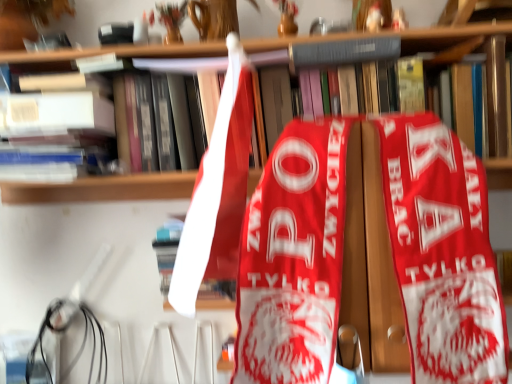
Question: Is hardcover book at upper center, the first book when ordered from right to left, aimed at matte white book at upper left, which is the second book from right to left?

Choices:
 (A) yes
 (B) no

Answer: (B)

Question: Does hardcover book at upper center, which is the 1th book in top-to-bottom order, appear on the left side of matte white book at upper left, arranged as the first book when ordered from the bottom?

Choices:
 (A) no
 (B) yes

Answer: (A)

Question: Can you confirm if hardcover book at upper center, the first book when ordered from right to left, is bigger than matte white book at upper left, which is the second book from right to left?

Choices:
 (A) no
 (B) yes

Answer: (A)

Question: Considering the relative positions of hardcover book at upper center, which is the 1th book in top-to-bottom order, and matte white book at upper left, which is the second book from right to left, in the image provided, is hardcover book at upper center, which is the 1th book in top-to-bottom order, behind matte white book at upper left, which is the second book from right to left,?

Choices:
 (A) yes
 (B) no

Answer: (B)

Question: Can you confirm if hardcover book at upper center, the first book when ordered from right to left, is thinner than matte white book at upper left, which is the 1th book from left to right?

Choices:
 (A) yes
 (B) no

Answer: (A)

Question: Is hardcover book at upper center, which is the 1th book in top-to-bottom order, beside matte white book at upper left, which is the second book from right to left?

Choices:
 (A) yes
 (B) no

Answer: (B)

Question: Is wooden bookcase at center shorter than matte white book at upper left, which is the second book from right to left?

Choices:
 (A) yes
 (B) no

Answer: (B)

Question: Is wooden bookcase at center at the left side of matte white book at upper left, which is the second book from right to left?

Choices:
 (A) no
 (B) yes

Answer: (A)

Question: Does wooden bookcase at center have a lesser width compared to matte white book at upper left, which appears as the 2th book when viewed from the top?

Choices:
 (A) yes
 (B) no

Answer: (A)

Question: Can you confirm if wooden bookcase at center is smaller than matte white book at upper left, arranged as the first book when ordered from the bottom?

Choices:
 (A) yes
 (B) no

Answer: (B)

Question: Could you tell me if wooden bookcase at center is turned towards matte white book at upper left, arranged as the first book when ordered from the bottom?

Choices:
 (A) no
 (B) yes

Answer: (A)

Question: Is wooden bookcase at center further to the viewer compared to matte white book at upper left, which is the second book from right to left?

Choices:
 (A) no
 (B) yes

Answer: (A)

Question: Considering the relative positions of wooden bookcase at center and hardcover book at upper center, which ranks as the second book in bottom-to-top order, in the image provided, is wooden bookcase at center behind hardcover book at upper center, which ranks as the second book in bottom-to-top order,?

Choices:
 (A) yes
 (B) no

Answer: (B)